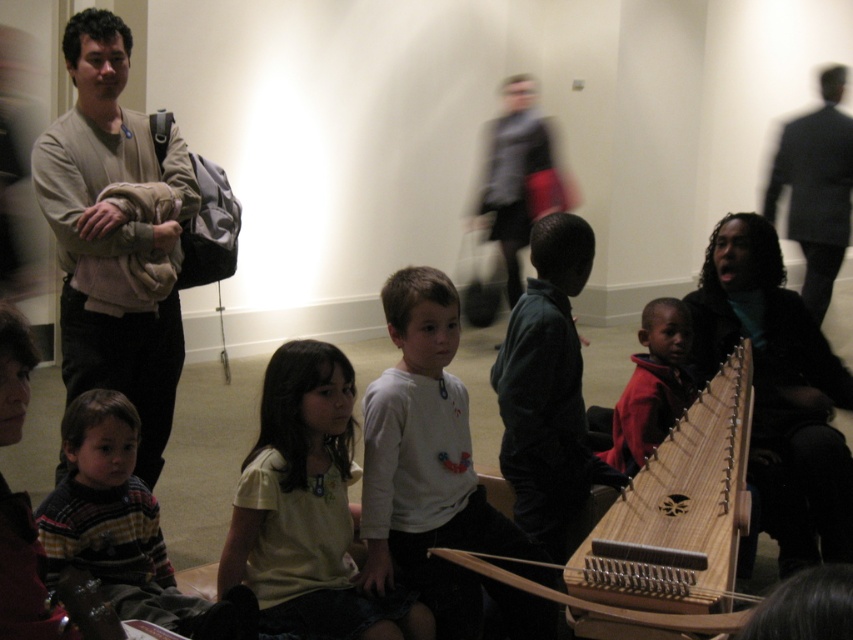
Question: Among these objects, which one is farthest from the camera?

Choices:
 (A) wooden string instrument at center
 (B) light yellow shirt at center
 (C) velvet dark green jacket at center
 (D) red fleece jacket at lower center

Answer: (D)

Question: Is light brown sweater at left in front of striped sweater at lower left?

Choices:
 (A) yes
 (B) no

Answer: (B)

Question: Is light brown sweater at left below red fleece jacket at lower center?

Choices:
 (A) yes
 (B) no

Answer: (B)

Question: Which point is closer to the camera?

Choices:
 (A) white matte shirt at center
 (B) striped sweater at lower left
 (C) matte black jacket at lower right

Answer: (B)

Question: Among these objects, which one is nearest to the camera?

Choices:
 (A) white matte shirt at center
 (B) wooden string instrument at center
 (C) red fleece jacket at lower center

Answer: (B)

Question: Can you confirm if matte black jacket at lower right is positioned to the left of red fleece jacket at lower center?

Choices:
 (A) no
 (B) yes

Answer: (A)